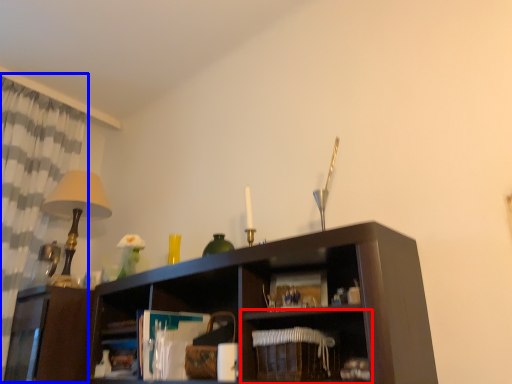
Question: Among these objects, which one is farthest to the camera, shelf (highlighted by a red box) or curtain (highlighted by a blue box)?

Choices:
 (A) shelf
 (B) curtain

Answer: (B)